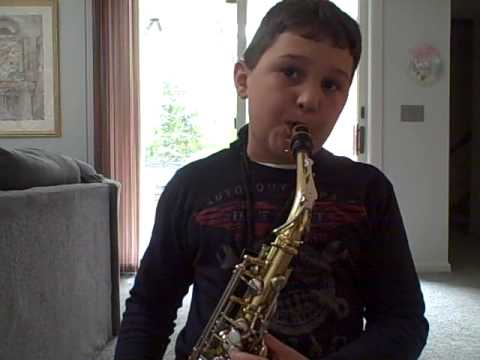
I want to click on curtains, so click(115, 106).